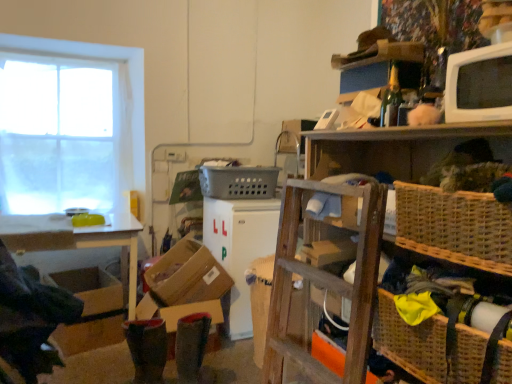
Locate an element on the screen. empty space that is ontop of white sheer curtain at left is located at coordinates (58, 59).